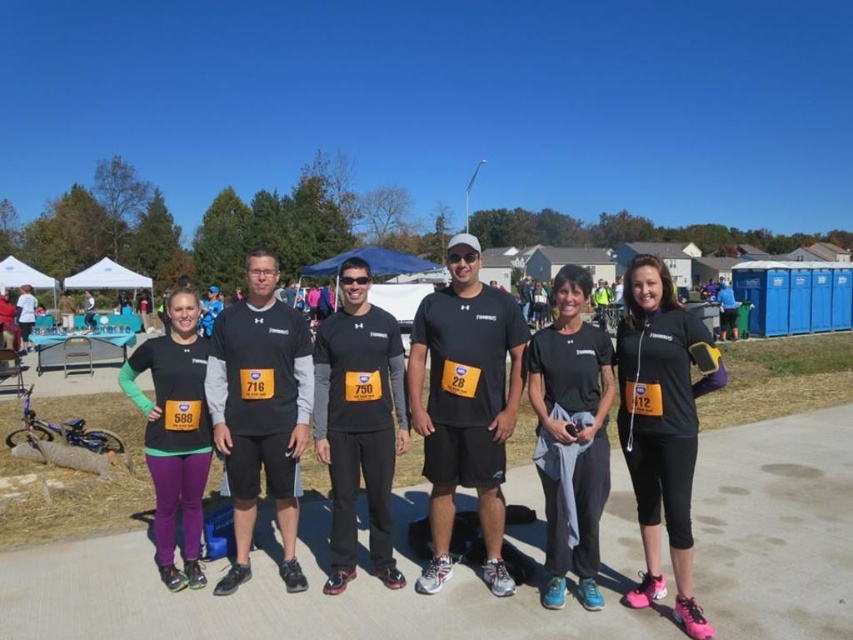
Does black matte running shoes at lower right appear on the right side of black matte t-shirt at center?

Indeed, black matte running shoes at lower right is positioned on the right side of black matte t-shirt at center.

Does black matte running shoes at lower right have a greater height compared to black matte t-shirt at center?

No.

The image size is (853, 640). I want to click on black matte running shoes at lower right, so click(x=660, y=428).

Locate an element on the screen. This screenshot has width=853, height=640. black matte running shoes at lower right is located at coordinates (660, 428).

Between black matte running shoes at lower right and purple matte leggings at center, which one has more height?

Standing taller between the two is purple matte leggings at center.

Is point (686, 356) farther from camera compared to point (164, 552)?

That is False.

Find the location of a particular element. black matte running shoes at lower right is located at coordinates (660, 428).

Between black matte t-shirt at center and purple matte leggings at center, which one appears on the left side from the viewer's perspective?

purple matte leggings at center is more to the left.

Can you confirm if black matte t-shirt at center is shorter than purple matte leggings at center?

Incorrect, black matte t-shirt at center's height does not fall short of purple matte leggings at center's.

Does point (544, 392) lie in front of point (190, 513)?

Yes, it is.

This screenshot has height=640, width=853. What are the coordinates of `black matte t-shirt at center` in the screenshot? It's located at (572, 435).